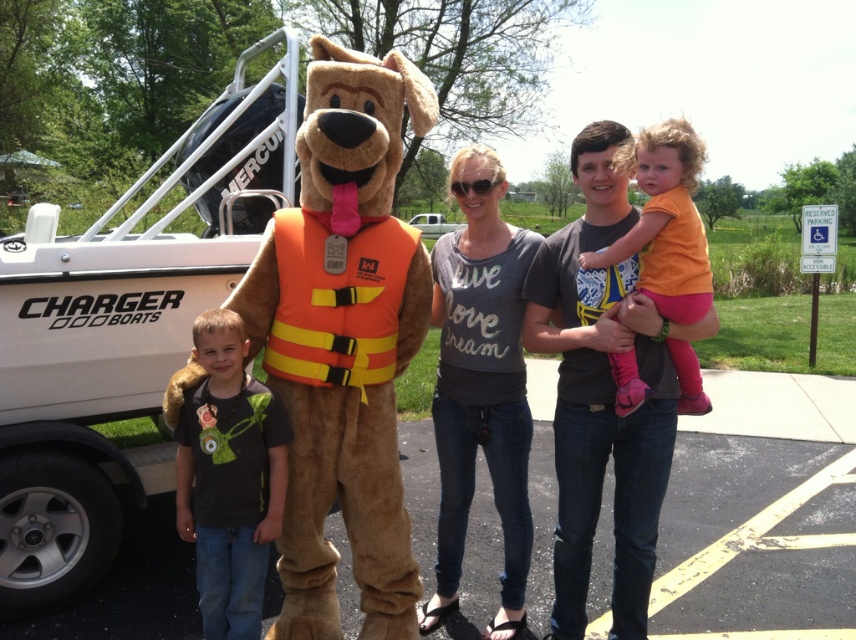
Can you confirm if dark gray t-shirt at center is positioned to the left of black matte t-shirt at center?

No, dark gray t-shirt at center is not to the left of black matte t-shirt at center.

Is point (586, 211) closer to camera compared to point (256, 474)?

No, (586, 211) is behind (256, 474).

This screenshot has height=640, width=856. Describe the element at coordinates (599, 394) in the screenshot. I see `dark gray t-shirt at center` at that location.

In order to click on dark gray t-shirt at center in this screenshot , I will do `click(599, 394)`.

Is point (348, 324) positioned before point (676, 365)?

Yes, point (348, 324) is in front of point (676, 365).

Is orange/yellow fabric life jacket at center above orange cotton shirt at upper center?

No, orange/yellow fabric life jacket at center is not above orange cotton shirt at upper center.

Who is more distant from viewer, (x=268, y=356) or (x=670, y=188)?

The point (x=268, y=356) is behind.

Where is `orange/yellow fabric life jacket at center`? orange/yellow fabric life jacket at center is located at coordinates (337, 301).

Is point (307, 404) closer to camera compared to point (361, 396)?

No, it is not.

The width and height of the screenshot is (856, 640). I want to click on fuzzy brown mascot at left, so click(x=343, y=339).